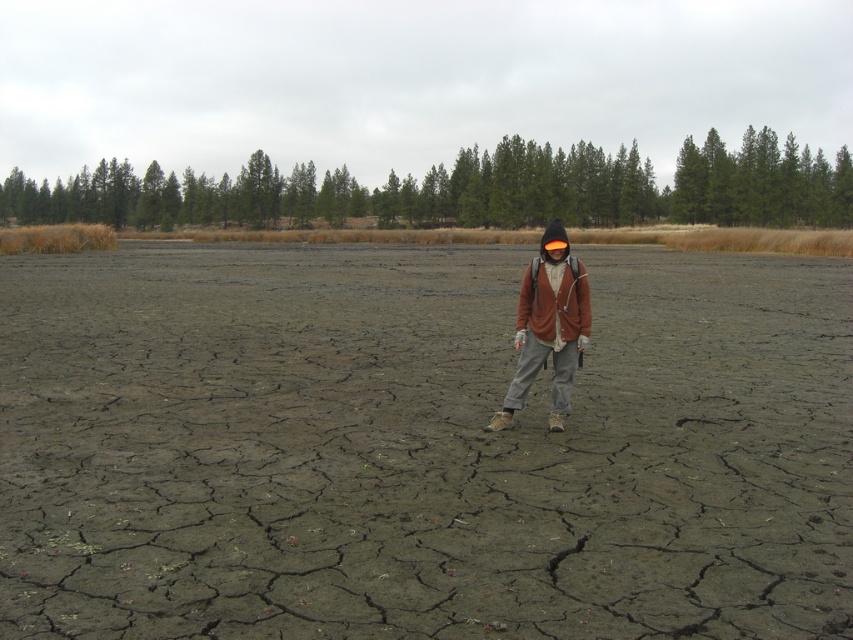
Which is more to the right, brown woolen sweater at center or brown soft jacket at center?

From the viewer's perspective, brown woolen sweater at center appears more on the right side.

Does brown woolen sweater at center have a lesser height compared to brown soft jacket at center?

No, brown woolen sweater at center is not shorter than brown soft jacket at center.

Is point (567, 323) positioned after point (521, 289)?

No, (567, 323) is closer to viewer.

This screenshot has width=853, height=640. What are the coordinates of `brown woolen sweater at center` in the screenshot? It's located at (548, 326).

Who is positioned more to the right, dull gray mud at center or brown woolen sweater at center?

Positioned to the right is dull gray mud at center.

Is dull gray mud at center smaller than brown woolen sweater at center?

No.

Between point (589, 492) and point (570, 298), which one is positioned in front?

Point (589, 492) is more forward.

What are the coordinates of `dull gray mud at center` in the screenshot? It's located at (421, 448).

Can you confirm if dull gray mud at center is positioned above brown soft jacket at center?

Indeed, dull gray mud at center is positioned over brown soft jacket at center.

Who is positioned more to the right, dull gray mud at center or brown soft jacket at center?

Positioned to the right is dull gray mud at center.

Which is behind, point (207, 362) or point (534, 333)?

Positioned behind is point (207, 362).

Locate an element on the screen. dull gray mud at center is located at coordinates (421, 448).